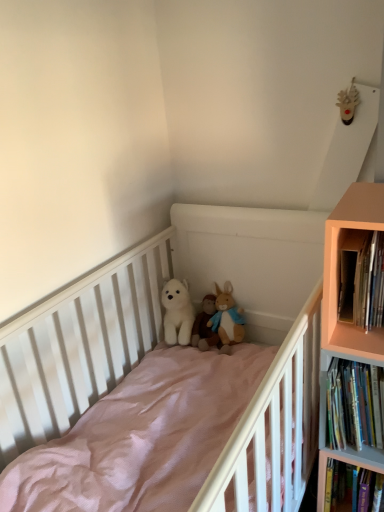
What do you see at coordinates (361, 278) in the screenshot? The width and height of the screenshot is (384, 512). I see `hardcover books at right, placed as the first book when sorted from top to bottom` at bounding box center [361, 278].

Find the location of a particular element. hardcover books at right, the second book when ordered from top to bottom is located at coordinates pyautogui.click(x=354, y=405).

Find the location of `fluffy white stuffed animal at center, the third toy viewed from the left`. fluffy white stuffed animal at center, the third toy viewed from the left is located at coordinates (187, 317).

Identify the location of white matte crib at center. This screenshot has width=384, height=512. (145, 309).

In order to face pale orange wood bookcase at right, should I rotate leftwards or rightwards?

Turn right by 22.188 degrees to look at pale orange wood bookcase at right.

Where is `hardcover books at right, the 2th book positioned from the bottom`? hardcover books at right, the 2th book positioned from the bottom is located at coordinates (361, 278).

From a real-world perspective, which is physically above, pale orange wood bookcase at right or white plush bear at center, arranged as the 1th toy when viewed from the left?

In real-world perspective, pale orange wood bookcase at right is above.

Do you think pale orange wood bookcase at right is within white plush bear at center, which is counted as the third toy, starting from the right, or outside of it?

pale orange wood bookcase at right is located beyond the bounds of white plush bear at center, which is counted as the third toy, starting from the right.

Where is `bookcase on the right side of white plush bear at center, which is counted as the third toy, starting from the right`? The image size is (384, 512). bookcase on the right side of white plush bear at center, which is counted as the third toy, starting from the right is located at coordinates (347, 321).

Based on the photo, how different are the orientations of pale orange wood bookcase at right and white plush bear at center, arranged as the 1th toy when viewed from the left, in degrees?

The facing directions of pale orange wood bookcase at right and white plush bear at center, arranged as the 1th toy when viewed from the left, are 2.44 degrees apart.

Considering the positions of objects white matte crib at center and white plush bear at center, the 2th toy viewed from the right, in the image provided, who is more to the right, white matte crib at center or white plush bear at center, the 2th toy viewed from the right,?

white plush bear at center, the 2th toy viewed from the right, is more to the right.

Is white matte crib at center facing towards white plush bear at center, marked as the second toy in a left-to-right arrangement?

No, white matte crib at center is not aimed at white plush bear at center, marked as the second toy in a left-to-right arrangement.

From a real-world perspective, does white matte crib at center sit lower than white plush bear at center, marked as the second toy in a left-to-right arrangement?

Indeed, from a real-world perspective, white matte crib at center is positioned beneath white plush bear at center, marked as the second toy in a left-to-right arrangement.

Is fluffy white stuffed animal at center, the third toy viewed from the left, directly adjacent to white matte crib at center?

No, fluffy white stuffed animal at center, the third toy viewed from the left, is not next to white matte crib at center.

Is the position of fluffy white stuffed animal at center, positioned as the first toy in right-to-left order, more distant than that of white matte crib at center?

That is True.

Considering the relative sizes of fluffy white stuffed animal at center, positioned as the first toy in right-to-left order, and white matte crib at center in the image provided, is fluffy white stuffed animal at center, positioned as the first toy in right-to-left order, taller than white matte crib at center?

In fact, fluffy white stuffed animal at center, positioned as the first toy in right-to-left order, may be shorter than white matte crib at center.

Between fluffy white stuffed animal at center, positioned as the first toy in right-to-left order, and white matte crib at center, which one has smaller size?

fluffy white stuffed animal at center, positioned as the first toy in right-to-left order, is smaller.

From a real-world perspective, is hardcover books at right, the 2th book positioned from the bottom, positioned under hardcover books at right, the second book when ordered from top to bottom, based on gravity?

Actually, hardcover books at right, the 2th book positioned from the bottom, is physically above hardcover books at right, the second book when ordered from top to bottom, in the real world.

In the scene shown: Between hardcover books at right, placed as the first book when sorted from top to bottom, and hardcover books at right, arranged as the first book when ordered from the bottom, which one has larger width?

hardcover books at right, arranged as the first book when ordered from the bottom, is wider.

Considering the positions of objects hardcover books at right, placed as the first book when sorted from top to bottom, and hardcover books at right, arranged as the first book when ordered from the bottom, in the image provided, who is more to the right, hardcover books at right, placed as the first book when sorted from top to bottom, or hardcover books at right, arranged as the first book when ordered from the bottom,?

hardcover books at right, arranged as the first book when ordered from the bottom, is more to the right.

Who is smaller, hardcover books at right, the 2th book positioned from the bottom, or hardcover books at right, the second book when ordered from top to bottom?

With smaller size is hardcover books at right, the 2th book positioned from the bottom.

Does white plush bear at center, the 2th toy viewed from the right, lie behind white matte crib at center?

Yes, it is behind white matte crib at center.

Is point (204, 311) closer to viewer compared to point (260, 242)?

No, (204, 311) is behind (260, 242).

From a real-world perspective, which object stands above the other?

From a 3D spatial view, white plush bear at center, the 2th toy viewed from the right, is above.

Does white plush bear at center, marked as the second toy in a left-to-right arrangement, have a smaller size compared to white matte crib at center?

Indeed, white plush bear at center, marked as the second toy in a left-to-right arrangement, has a smaller size compared to white matte crib at center.

Based on the photo, relative to hardcover books at right, arranged as the first book when ordered from the bottom, is white plush bear at center, which is counted as the third toy, starting from the right, in front or behind?

Visually, white plush bear at center, which is counted as the third toy, starting from the right, is located behind hardcover books at right, arranged as the first book when ordered from the bottom.

How many degrees apart are the facing directions of white plush bear at center, which is counted as the third toy, starting from the right, and hardcover books at right, the second book when ordered from top to bottom?

The facing directions of white plush bear at center, which is counted as the third toy, starting from the right, and hardcover books at right, the second book when ordered from top to bottom, are 1.96 degrees apart.

Looking at their sizes, would you say white plush bear at center, which is counted as the third toy, starting from the right, is wider or thinner than hardcover books at right, the second book when ordered from top to bottom?

In the image, white plush bear at center, which is counted as the third toy, starting from the right, appears to be more narrow than hardcover books at right, the second book when ordered from top to bottom.

From a real-world perspective, who is located higher, white plush bear at center, arranged as the 1th toy when viewed from the left, or hardcover books at right, the second book when ordered from top to bottom?

hardcover books at right, the second book when ordered from top to bottom, from a real-world perspective.

Does point (176, 294) appear closer or farther from the camera than point (165, 282)?

Point (176, 294).

What's the angular difference between white plush bear at center, arranged as the 1th toy when viewed from the left, and fluffy white stuffed animal at center, positioned as the first toy in right-to-left order,'s facing directions?

0.00153 degrees separate the facing orientations of white plush bear at center, arranged as the 1th toy when viewed from the left, and fluffy white stuffed animal at center, positioned as the first toy in right-to-left order.

Which object is positioned more to the right, white plush bear at center, arranged as the 1th toy when viewed from the left, or fluffy white stuffed animal at center, positioned as the first toy in right-to-left order?

Positioned to the right is fluffy white stuffed animal at center, positioned as the first toy in right-to-left order.

Looking at this image, could you tell me if white plush bear at center, arranged as the 1th toy when viewed from the left, is turned towards fluffy white stuffed animal at center, the third toy viewed from the left?

No.

This screenshot has width=384, height=512. In order to click on bookcase below the white plush bear at center, which is counted as the third toy, starting from the right (from the image's perspective) in this screenshot , I will do `click(347, 321)`.

Identify the location of infant bed that appears in front of the white plush bear at center, the 2th toy viewed from the right. (145, 309).

Looking at the image, which one is located closer to white matte crib at center, white plush bear at center, arranged as the 1th toy when viewed from the left, or hardcover books at right, arranged as the first book when ordered from the bottom?

white plush bear at center, arranged as the 1th toy when viewed from the left, is positioned closer to the anchor white matte crib at center.

Based on their spatial positions, is pale orange wood bookcase at right or white matte crib at center closer to fluffy white stuffed animal at center, the third toy viewed from the left?

white matte crib at center lies closer to fluffy white stuffed animal at center, the third toy viewed from the left, than the other object.

Consider the image. Estimate the real-world distances between objects in this image. Which object is further from white plush bear at center, the 2th toy viewed from the right, hardcover books at right, the second book when ordered from top to bottom, or pale orange wood bookcase at right?

Based on the image, pale orange wood bookcase at right appears to be further to white plush bear at center, the 2th toy viewed from the right.

From the image, which object appears to be farther from hardcover books at right, arranged as the first book when ordered from the bottom, white matte crib at center or hardcover books at right, the 2th book positioned from the bottom?

white matte crib at center.

From the picture: Considering their positions, is hardcover books at right, the 2th book positioned from the bottom, positioned closer to white plush bear at center, which is counted as the third toy, starting from the right, than white matte crib at center?

Among the two, white matte crib at center is located nearer to white plush bear at center, which is counted as the third toy, starting from the right.

Based on their spatial positions, is hardcover books at right, the 2th book positioned from the bottom, or fluffy white stuffed animal at center, positioned as the first toy in right-to-left order, closer to white plush bear at center, marked as the second toy in a left-to-right arrangement?

fluffy white stuffed animal at center, positioned as the first toy in right-to-left order, is closer to white plush bear at center, marked as the second toy in a left-to-right arrangement.

Based on their spatial positions, is hardcover books at right, the 2th book positioned from the bottom, or white plush bear at center, which is counted as the third toy, starting from the right, closer to hardcover books at right, the second book when ordered from top to bottom?

hardcover books at right, the 2th book positioned from the bottom, lies closer to hardcover books at right, the second book when ordered from top to bottom, than the other object.

Which object lies further to the anchor point white matte crib at center, fluffy white stuffed animal at center, the third toy viewed from the left, or white plush bear at center, arranged as the 1th toy when viewed from the left?

white plush bear at center, arranged as the 1th toy when viewed from the left.

Locate an element on the screen. Image resolution: width=384 pixels, height=512 pixels. toy positioned between hardcover books at right, placed as the first book when sorted from top to bottom, and white plush bear at center, arranged as the 1th toy when viewed from the left, from near to far is located at coordinates (187, 317).

Where is `book located between hardcover books at right, the 2th book positioned from the bottom, and white plush bear at center, which is counted as the third toy, starting from the right, in the depth direction`? This screenshot has width=384, height=512. book located between hardcover books at right, the 2th book positioned from the bottom, and white plush bear at center, which is counted as the third toy, starting from the right, in the depth direction is located at coordinates (354, 405).

Where is `book between hardcover books at right, the 2th book positioned from the bottom, and white plush bear at center, the 2th toy viewed from the right, from front to back`? book between hardcover books at right, the 2th book positioned from the bottom, and white plush bear at center, the 2th toy viewed from the right, from front to back is located at coordinates (354, 405).

Where is `toy between white matte crib at center and white plush bear at center, arranged as the 1th toy when viewed from the left, along the z-axis`? toy between white matte crib at center and white plush bear at center, arranged as the 1th toy when viewed from the left, along the z-axis is located at coordinates (187, 317).